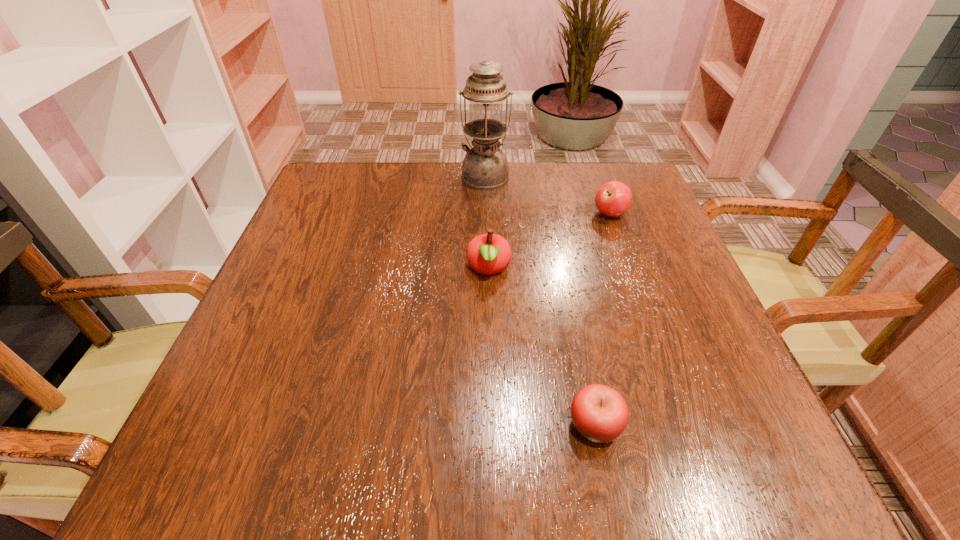
This screenshot has width=960, height=540. What are the coordinates of `oil lamp` in the screenshot? It's located at (485, 166).

Where is `the farthest object`? The image size is (960, 540). the farthest object is located at coordinates click(485, 166).

Find the location of a particular element. This screenshot has width=960, height=540. the farthest apple is located at coordinates (614, 198).

The height and width of the screenshot is (540, 960). I want to click on the rightmost apple, so click(x=614, y=198).

The width and height of the screenshot is (960, 540). I want to click on the second nearest object, so click(x=489, y=253).

Locate an element on the screen. the leftmost apple is located at coordinates (489, 253).

Where is `the nearest apple`? The width and height of the screenshot is (960, 540). the nearest apple is located at coordinates (600, 413).

Where is `the second object from right to left`? The image size is (960, 540). the second object from right to left is located at coordinates (600, 413).

Image resolution: width=960 pixels, height=540 pixels. I want to click on vacant space located on the left of the farthest object, so click(343, 176).

Locate an element on the screen. This screenshot has height=540, width=960. vacant space located on the left of the rightmost apple is located at coordinates 482,214.